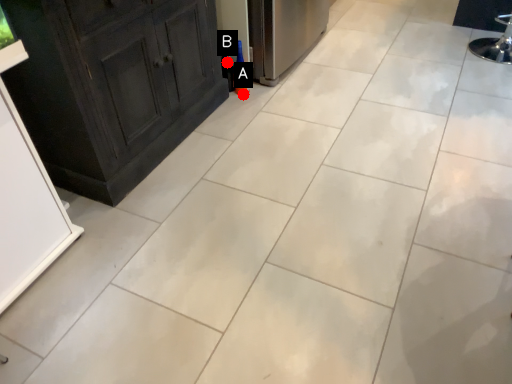
Question: Two points are circled on the image, labeled by A and B beside each circle. Among these points, which one is farthest from the camera?

Choices:
 (A) A is further
 (B) B is further

Answer: (A)